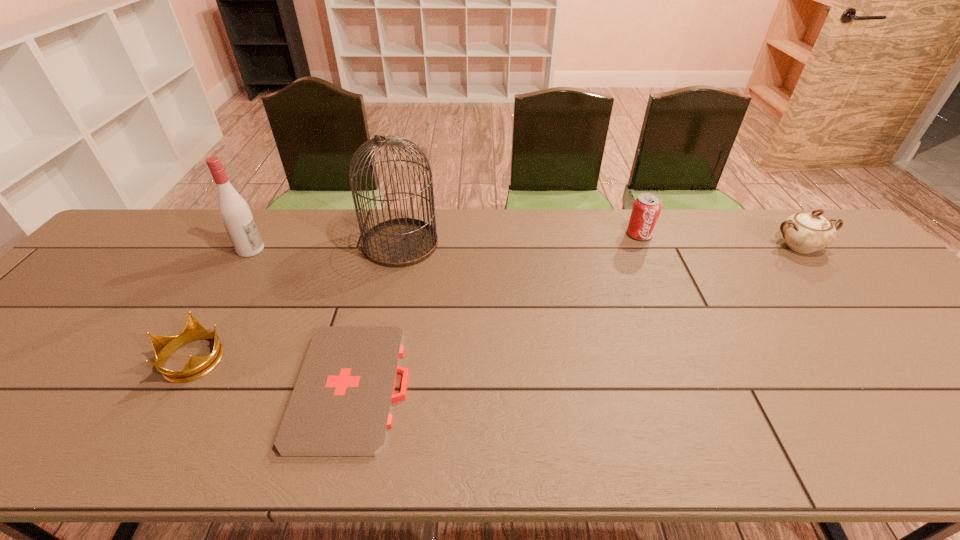
Locate an element on the screen. The height and width of the screenshot is (540, 960). vacant space located on the right of the crown is located at coordinates (342, 358).

This screenshot has width=960, height=540. In order to click on vacant position located 0.330m on handle side the shortest object in this screenshot , I will do `click(560, 387)`.

Locate an element on the screen. birdcage that is at the far edge is located at coordinates (401, 242).

Locate an element on the screen. Image resolution: width=960 pixels, height=540 pixels. alcohol that is positioned at the far edge is located at coordinates (234, 211).

Locate an element on the screen. soda can that is at the far edge is located at coordinates (646, 209).

Locate an element on the screen. chinaware that is at the far edge is located at coordinates (805, 232).

I want to click on object that is at the near edge, so [341, 404].

I want to click on object that is at the right edge, so click(805, 232).

The height and width of the screenshot is (540, 960). In order to click on object located in the far right corner section of the desktop in this screenshot , I will do `click(805, 232)`.

In the image, there is a desktop. What are the coordinates of `vacant space at the far edge` in the screenshot? It's located at (708, 248).